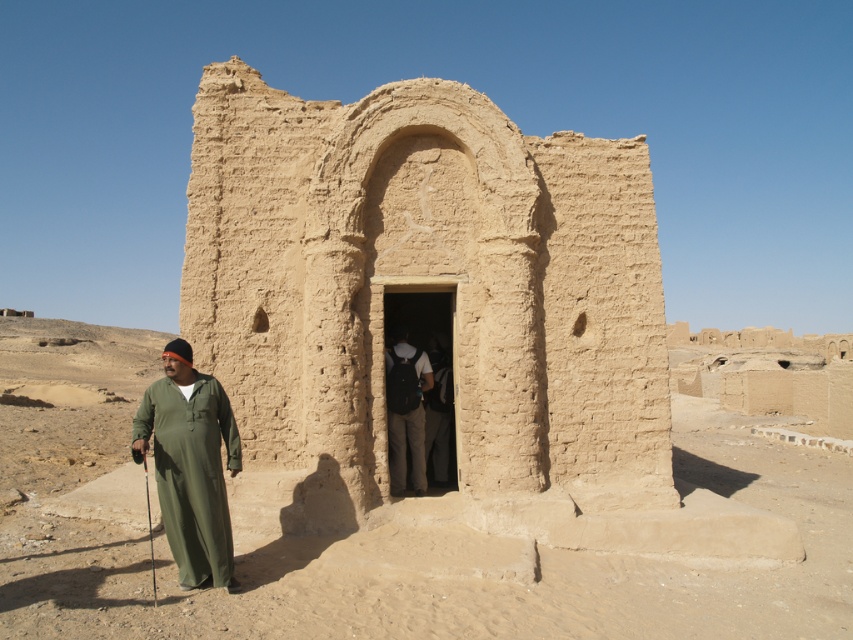
Does point (195, 595) come closer to viewer compared to point (392, 442)?

Yes, point (195, 595) is in front of point (392, 442).

Is point (3, 464) behind point (404, 355)?

Yes, point (3, 464) is behind point (404, 355).

Where is `brown textured wall at center`? The height and width of the screenshot is (640, 853). brown textured wall at center is located at coordinates (358, 536).

Looking at this image, who is more forward, (650, 490) or (589, 614)?

Point (589, 614) is more forward.

What do you see at coordinates (426, 291) in the screenshot? This screenshot has height=640, width=853. I see `earthy clay ruins at center` at bounding box center [426, 291].

The width and height of the screenshot is (853, 640). What are the coordinates of `earthy clay ruins at center` in the screenshot? It's located at (426, 291).

Does point (192, 380) come farther from viewer compared to point (404, 392)?

No, it is in front of (404, 392).

Does green matte robe at left have a larger size compared to dark gray fabric backpack at center?

Yes.

Which is in front, point (201, 433) or point (416, 476)?

Point (201, 433) is in front.

Locate an element on the screen. The width and height of the screenshot is (853, 640). green matte robe at left is located at coordinates (190, 468).